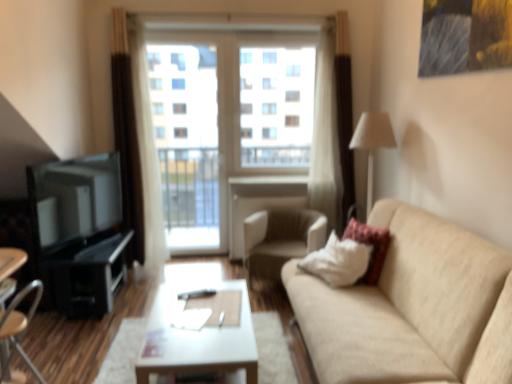
Question: Relative to beige fabric couch at right, is wooden chair at lower left, which appears as the 1th chair when viewed from the front, in front or behind?

Choices:
 (A) behind
 (B) front

Answer: (A)

Question: From a real-world perspective, is wooden chair at lower left, which ranks as the second chair in back-to-front order, above or below beige fabric couch at right?

Choices:
 (A) above
 (B) below

Answer: (B)

Question: Based on their relative distances, which object is farther from the beige fabric couch at right?

Choices:
 (A) beige fabric armchair at center, positioned as the 2th chair in left-to-right order
 (B) velvet-like beige pillow at right
 (C) transparent glass window at center
 (D) white glossy coffee table at center
 (E) matte black tv at left

Answer: (C)

Question: Which is farther from the matte black tv at left?

Choices:
 (A) wooden chair at lower left, which appears as the 1th chair when viewed from the front
 (B) beige fabric couch at right
 (C) beige fabric armchair at center, which is the 1th chair in right-to-left order
 (D) white glossy coffee table at center
 (E) transparent glass screen door at center

Answer: (B)